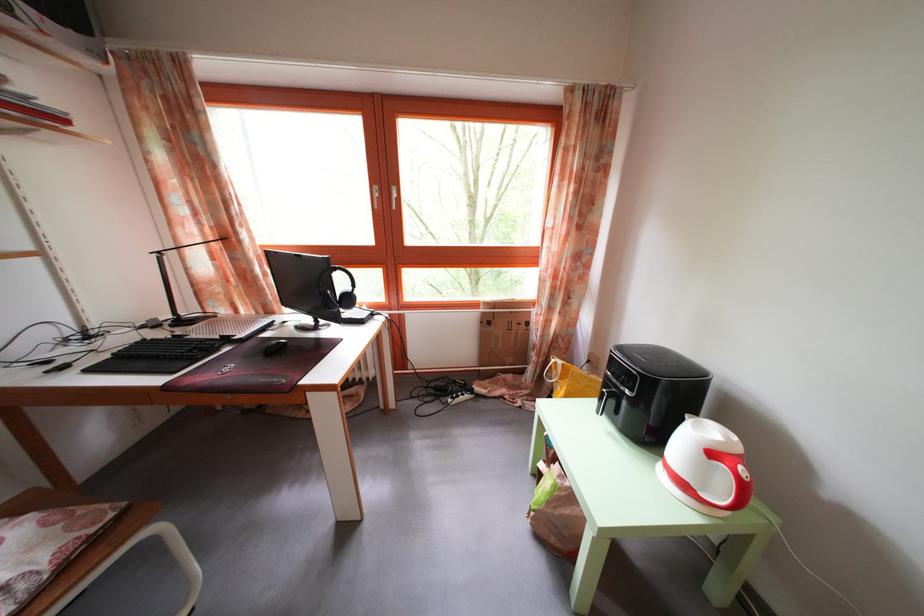
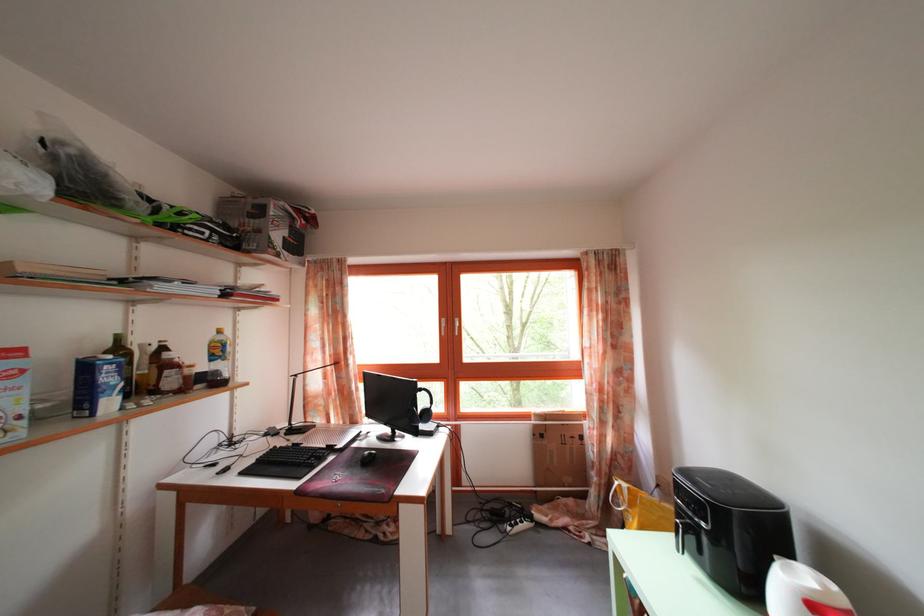
Question: Which direction would the cameraman need to move to produce the second image? Reply with the corresponding letter.

Choices:
 (A) Left
 (B) Right
 (C) Forward
 (D) Backward

Answer: (D)